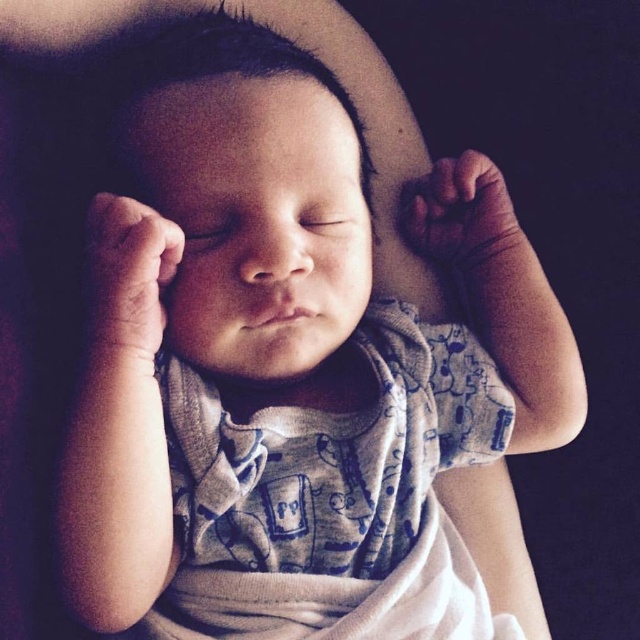
A baby is sleeping peacefully in a crib. The baby is wearing a light gray onesie with blue patterns. There are two points marked on the image, one at point A and another at point B. The coordinates for point A are given as (100, 323). The coordinates for point B are not provided. If the distance between these two points is 24.08 inches, can you determine whether point B is closer to the baby or farther away from the baby compared to point A?

Result: The distance between point A and point B is 24.08 inches. Since point B is not described in relation to the baby, we cannot determine if it is closer or farther away from the baby compared to point A based on the provided information.

You are a pediatrician examining a baby. You notice two hands on the baby, the smooth skin hand at center and the smooth skin hand at upper center. Which hand is wider?

The smooth skin hand at upper center is wider than the smooth skin hand at center.